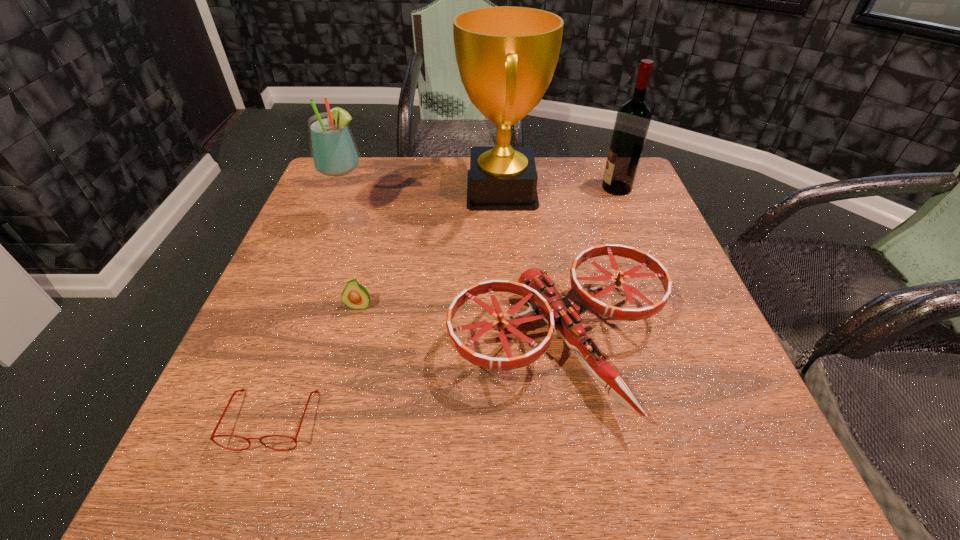
Locate an element on the screen. This screenshot has width=960, height=540. vacant space that satisfies the following two spatial constraints: 1. on the front-facing side of the award; 2. on the cut side of the second shortest object is located at coordinates (509, 306).